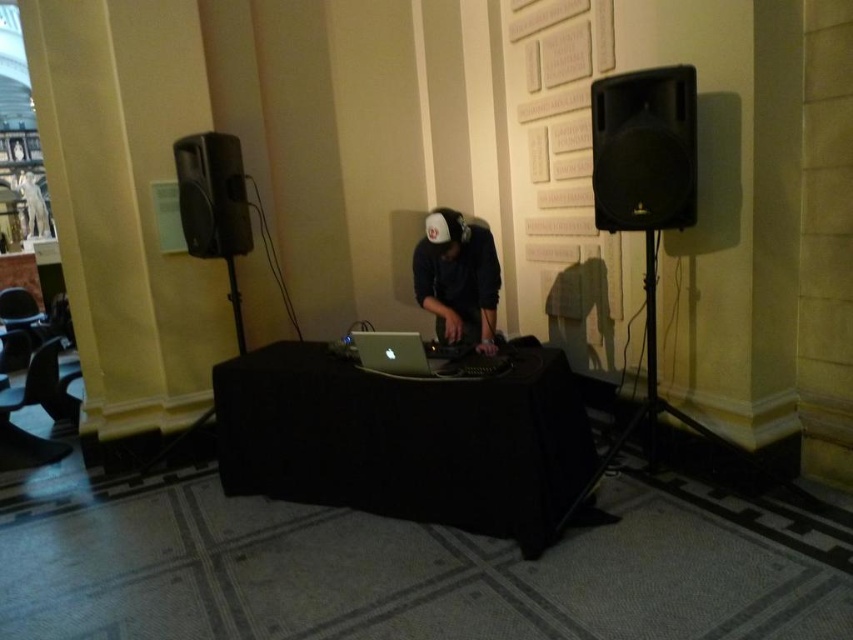
Does black matte speaker at left appear under silver metallic laptop at center?

Actually, black matte speaker at left is above silver metallic laptop at center.

The image size is (853, 640). Find the location of `black matte speaker at left`. black matte speaker at left is located at coordinates (212, 195).

The image size is (853, 640). In order to click on black matte speaker at left in this screenshot , I will do `click(212, 195)`.

In the scene shown: Can you confirm if black fabric table at center is wider than black matte hoodie at center?

Correct, the width of black fabric table at center exceeds that of black matte hoodie at center.

Is black fabric table at center positioned behind black matte hoodie at center?

No.

The width and height of the screenshot is (853, 640). What do you see at coordinates (407, 440) in the screenshot?
I see `black fabric table at center` at bounding box center [407, 440].

Locate an element on the screen. This screenshot has height=640, width=853. black fabric table at center is located at coordinates (407, 440).

This screenshot has width=853, height=640. Describe the element at coordinates (643, 148) in the screenshot. I see `black matte speaker at right` at that location.

The image size is (853, 640). I want to click on black matte speaker at right, so click(643, 148).